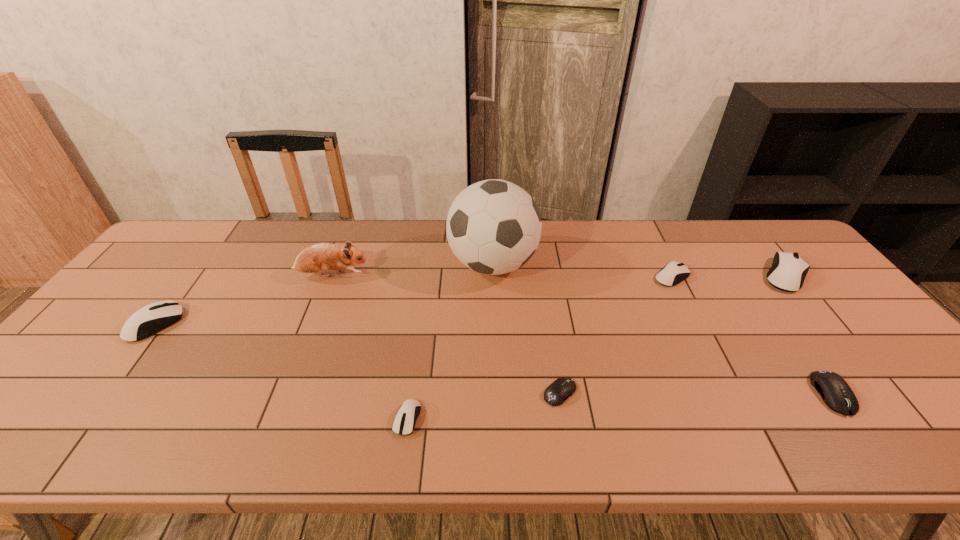
Find the location of a particular element. This screenshot has height=540, width=960. soccer ball is located at coordinates (493, 227).

This screenshot has width=960, height=540. In order to click on black soccer ball in this screenshot , I will do `click(493, 227)`.

Locate an element on the screen. brown hamster is located at coordinates (323, 257).

Find the location of a particular element. This screenshot has width=960, height=540. the second tallest object is located at coordinates (323, 257).

At what (x,y) coordinates should I click in order to perform the action: click on the tallest computer equipment. Please return your answer as a coordinate pair (x, y). The height and width of the screenshot is (540, 960). Looking at the image, I should click on coord(788,271).

What are the coordinates of `the third tallest object` in the screenshot? It's located at (788, 271).

At what (x,y) coordinates should I click in order to perform the action: click on the fourth nearest object. Please return your answer as a coordinate pair (x, y). The width and height of the screenshot is (960, 540). Looking at the image, I should click on (149, 320).

Locate an element on the screen. the leftmost object is located at coordinates (149, 320).

Locate an element on the screen. Image resolution: width=960 pixels, height=540 pixels. the sixth object from left to right is located at coordinates (673, 273).

Where is `the third biggest white mouse`? The height and width of the screenshot is (540, 960). the third biggest white mouse is located at coordinates (673, 273).